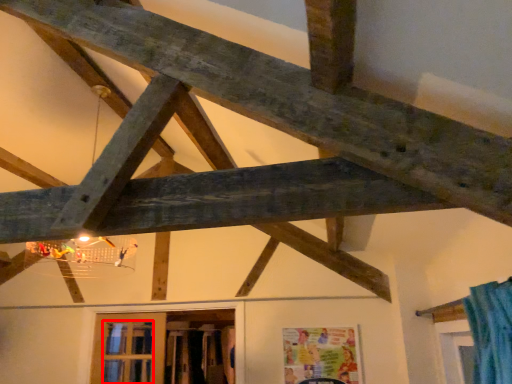
Question: From the image's perspective, what is the correct spatial relationship of window (annotated by the red box) in relation to window?

Choices:
 (A) above
 (B) below

Answer: (B)